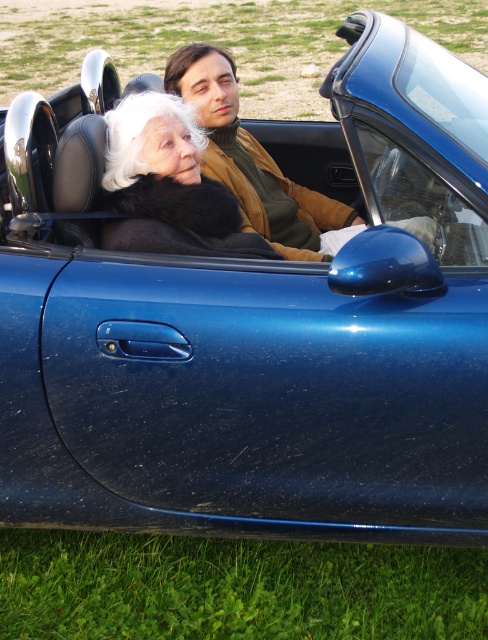
You are standing in front of the convertible car and want to determine which of the two points, point (212, 253) or point (231, 115), is nearer to you. Based on the scene description, which point is closer?

Point (212, 253) is closer to the viewer than point (231, 115).

You are a fashion designer observing the two coats in the image. Which coat is shorter in height between the matte black fur coat at center and the brown leather jacket at center?

The matte black fur coat at center has a lesser height compared to the brown leather jacket at center, so the matte black fur coat at center is shorter in height.